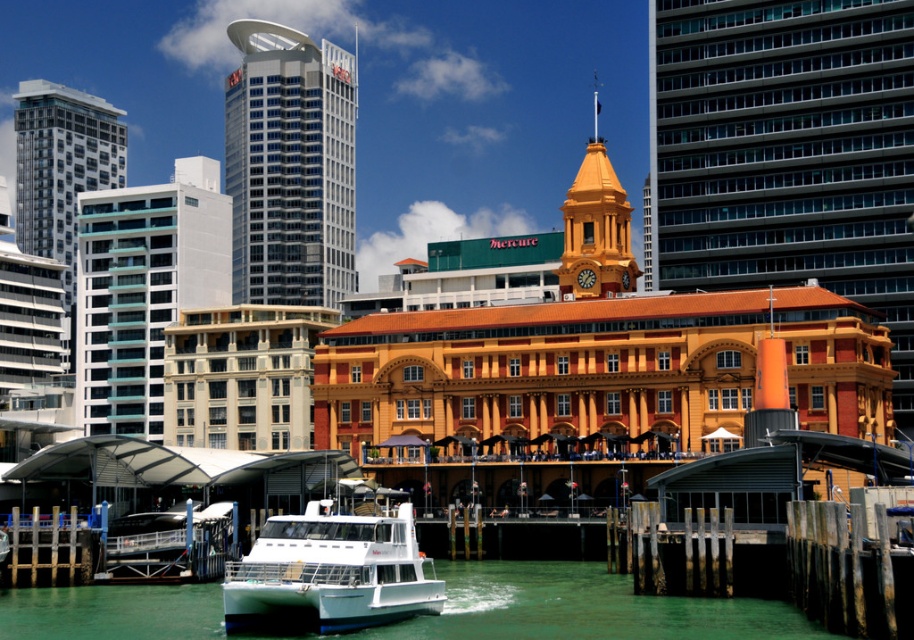
Does point (147, 348) lie behind point (30, 106)?

No, (147, 348) is in front of (30, 106).

Is point (93, 259) farther from viewer compared to point (93, 164)?

No, it is not.

Where is `white glass building at left`? The width and height of the screenshot is (914, 640). white glass building at left is located at coordinates (142, 291).

Does glassy blue skyscraper at upper left appear over white glass building at left?

Yes, glassy blue skyscraper at upper left is above white glass building at left.

The width and height of the screenshot is (914, 640). Identify the location of glassy blue skyscraper at upper left. (289, 164).

Is point (232, 177) positioned before point (101, 248)?

No, (232, 177) is further to viewer.

Locate an element on the screen. This screenshot has height=640, width=914. glassy blue skyscraper at upper left is located at coordinates (289, 164).

Describe the element at coordinates (583, 608) in the screenshot. Image resolution: width=914 pixels, height=640 pixels. I see `green water at lower center` at that location.

Which is below, green water at lower center or matte glass building at left?

green water at lower center

Is point (565, 570) farther from camera compared to point (121, 134)?

No.

I want to click on green water at lower center, so click(x=583, y=608).